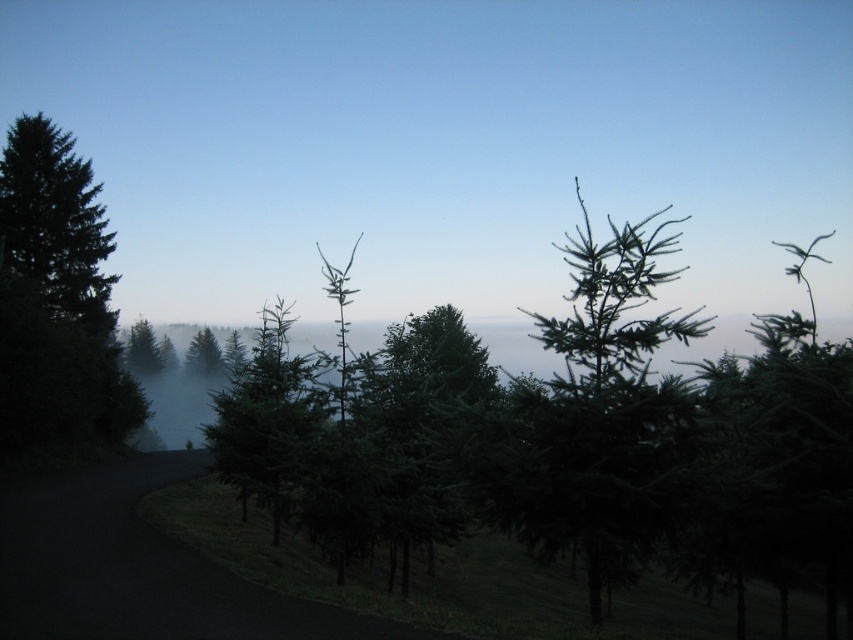
Is point (538, 531) closer to viewer compared to point (61, 346)?

Yes.

Image resolution: width=853 pixels, height=640 pixels. Find the location of `green needle-like tree at center`. green needle-like tree at center is located at coordinates (606, 401).

Is point (401, 54) more distant than point (282, 461)?

That is True.

The height and width of the screenshot is (640, 853). What are the coordinates of `green matte trees at left` in the screenshot? It's located at (444, 144).

This screenshot has height=640, width=853. In order to click on green matte trees at left in this screenshot , I will do `click(444, 144)`.

Which is behind, point (115, 252) or point (541, 456)?

The point (115, 252) is more distant.

From the picture: Is green matte trees at left to the right of green needle-like tree at center from the viewer's perspective?

Incorrect, green matte trees at left is not on the right side of green needle-like tree at center.

Find the location of a particular element. green matte trees at left is located at coordinates (444, 144).